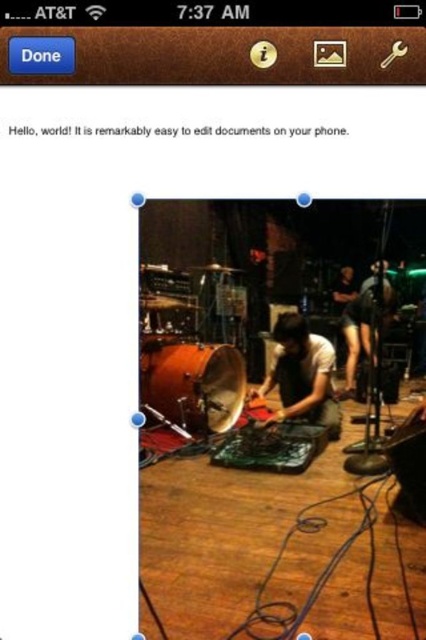
Question: Which point is farther to the camera?

Choices:
 (A) (184, 424)
 (B) (374, 282)

Answer: (B)

Question: Which object is positioned farthest from the matte black shirt at center?

Choices:
 (A) skinny jeans at right
 (B) dark brown leather jacket at right

Answer: (B)

Question: Observing the image, what is the correct spatial positioning of skinny jeans at right in reference to dark brown leather jacket at right?

Choices:
 (A) above
 (B) below

Answer: (B)

Question: Does matte brown drum at center appear under skinny jeans at right?

Choices:
 (A) yes
 (B) no

Answer: (A)

Question: Which object is positioned closest to the dark brown leather jacket at right?

Choices:
 (A) skinny jeans at right
 (B) matte brown drum at center

Answer: (A)

Question: Can you confirm if matte brown drum at center is positioned above matte black shirt at center?

Choices:
 (A) no
 (B) yes

Answer: (B)